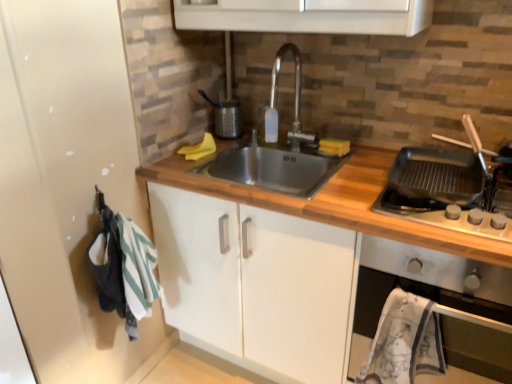
Question: Considering the relative positions of wooden at center and metallic silver oven at right in the image provided, is wooden at center to the right of metallic silver oven at right from the viewer's perspective?

Choices:
 (A) no
 (B) yes

Answer: (A)

Question: Is wooden at center not inside metallic silver oven at right?

Choices:
 (A) yes
 (B) no

Answer: (A)

Question: Considering the relative sizes of wooden at center and metallic silver oven at right in the image provided, is wooden at center bigger than metallic silver oven at right?

Choices:
 (A) no
 (B) yes

Answer: (B)

Question: Is the depth of wooden at center less than that of metallic silver oven at right?

Choices:
 (A) no
 (B) yes

Answer: (B)

Question: From the image's perspective, would you say wooden at center is positioned over metallic silver oven at right?

Choices:
 (A) no
 (B) yes

Answer: (A)

Question: From the image's perspective, relative to metallic silver oven at right, is black matte griddle at right above or below?

Choices:
 (A) below
 (B) above

Answer: (B)

Question: Is point (437, 221) closer or farther from the camera than point (449, 279)?

Choices:
 (A) closer
 (B) farther

Answer: (A)

Question: In terms of height, does black matte griddle at right look taller or shorter compared to metallic silver oven at right?

Choices:
 (A) short
 (B) tall

Answer: (A)

Question: Considering the positions of black matte griddle at right and metallic silver oven at right in the image, is black matte griddle at right wider or thinner than metallic silver oven at right?

Choices:
 (A) wide
 (B) thin

Answer: (B)

Question: Based on their sizes in the image, would you say wooden at center is bigger or smaller than black matte griddle at right?

Choices:
 (A) small
 (B) big

Answer: (B)

Question: Considering the relative positions of wooden at center and black matte griddle at right in the image provided, is wooden at center to the left or to the right of black matte griddle at right?

Choices:
 (A) left
 (B) right

Answer: (A)

Question: Considering the positions of wooden at center and black matte griddle at right in the image, is wooden at center taller or shorter than black matte griddle at right?

Choices:
 (A) short
 (B) tall

Answer: (B)

Question: Is point [x=472, y=248] closer or farther from the camera than point [x=499, y=233]?

Choices:
 (A) closer
 (B) farther

Answer: (A)

Question: Which is correct: metallic silver oven at right is inside black matte griddle at right, or outside of it?

Choices:
 (A) outside
 (B) inside

Answer: (A)

Question: Does point (361, 334) appear closer or farther from the camera than point (463, 216)?

Choices:
 (A) farther
 (B) closer

Answer: (A)